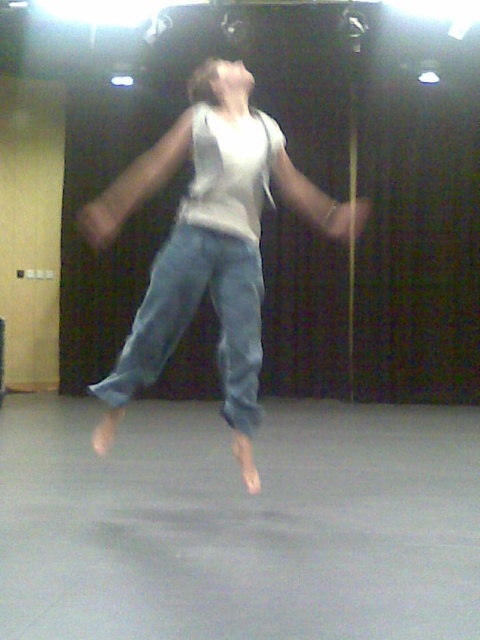
Between white cotton tank top at center and denim at center, which one is positioned higher?

white cotton tank top at center

Measure the distance between point (117, 369) and camera.

They are 6.53 meters apart.

What do you see at coordinates (210, 243) in the screenshot?
I see `white cotton tank top at center` at bounding box center [210, 243].

Find the location of a particular element. white cotton tank top at center is located at coordinates (210, 243).